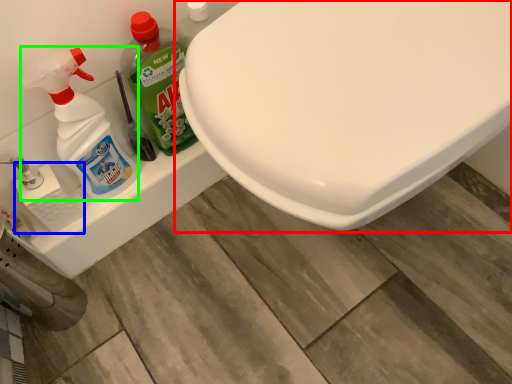
Question: Based on their relative distances, which object is farther from toilet (highlighted by a red box)? Choose from toilet paper (highlighted by a blue box) and cleaning product (highlighted by a green box).

Choices:
 (A) toilet paper
 (B) cleaning product

Answer: (A)